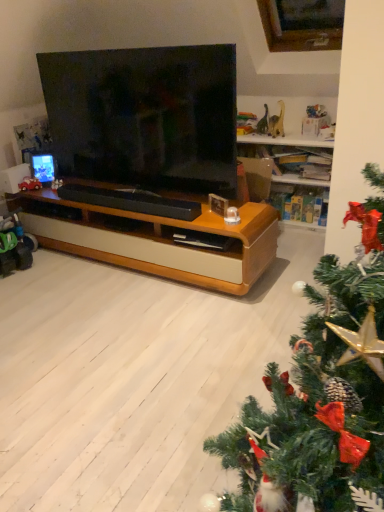
Question: Would you say matte black tv at center is a long distance from green plastic toy at left, the 1th toy viewed from the front?

Choices:
 (A) yes
 (B) no

Answer: (A)

Question: Does matte black tv at center appear on the right side of green plastic toy at left, the 1th toy viewed from the front?

Choices:
 (A) yes
 (B) no

Answer: (A)

Question: Does matte black tv at center lie behind green plastic toy at left, which ranks as the 2th toy in back-to-front order?

Choices:
 (A) no
 (B) yes

Answer: (A)

Question: Is green plastic toy at left, which ranks as the 2th toy in back-to-front order, inside matte black tv at center?

Choices:
 (A) yes
 (B) no

Answer: (B)

Question: Is matte black tv at center shorter than green plastic toy at left, placed as the 1th toy when sorted from bottom to top?

Choices:
 (A) no
 (B) yes

Answer: (A)

Question: From the image's perspective, would you say matte black tv at center is positioned over green plastic toy at left, the 1th toy viewed from the front?

Choices:
 (A) yes
 (B) no

Answer: (A)

Question: Considering the relative sizes of green plastic toy at left, which ranks as the 2th toy in back-to-front order, and black matte soundbar at center in the image provided, is green plastic toy at left, which ranks as the 2th toy in back-to-front order, wider than black matte soundbar at center?

Choices:
 (A) yes
 (B) no

Answer: (A)

Question: Considering the relative positions of green plastic toy at left, the 1th toy viewed from the front, and black matte soundbar at center in the image provided, is green plastic toy at left, the 1th toy viewed from the front, to the right of black matte soundbar at center from the viewer's perspective?

Choices:
 (A) no
 (B) yes

Answer: (A)

Question: Does green plastic toy at left, which ranks as the 2th toy in back-to-front order, have a lesser height compared to black matte soundbar at center?

Choices:
 (A) yes
 (B) no

Answer: (B)

Question: Is green plastic toy at left, placed as the 1th toy when sorted from bottom to top, closer to camera compared to black matte soundbar at center?

Choices:
 (A) no
 (B) yes

Answer: (A)

Question: Is green plastic toy at left, which ranks as the 2th toy in back-to-front order, outside black matte soundbar at center?

Choices:
 (A) yes
 (B) no

Answer: (A)

Question: From a real-world perspective, is green plastic toy at left, which ranks as the 2th toy in back-to-front order, located higher than black matte soundbar at center?

Choices:
 (A) yes
 (B) no

Answer: (B)

Question: Is black matte soundbar at center turned away from green plastic toy at left, placed as the 1th toy when sorted from bottom to top?

Choices:
 (A) no
 (B) yes

Answer: (A)